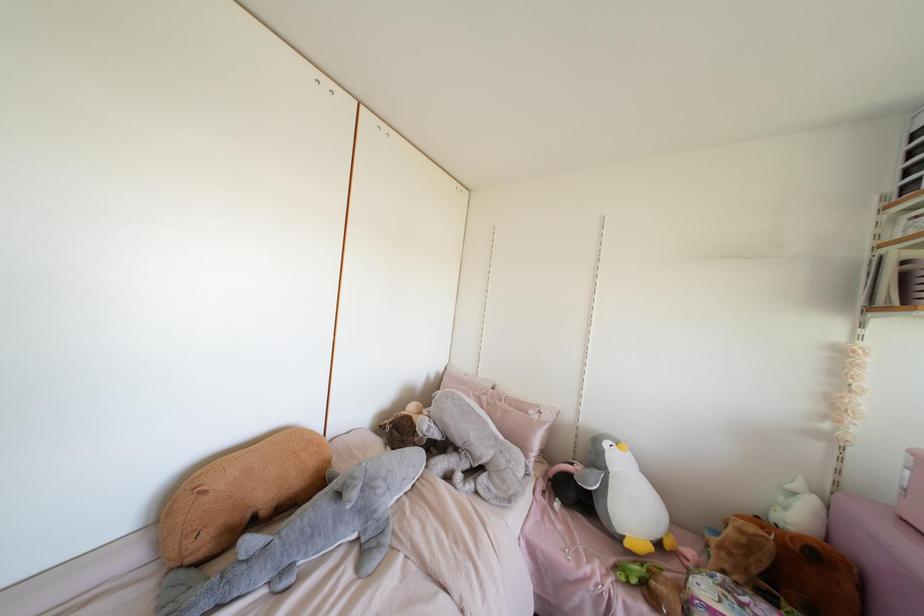
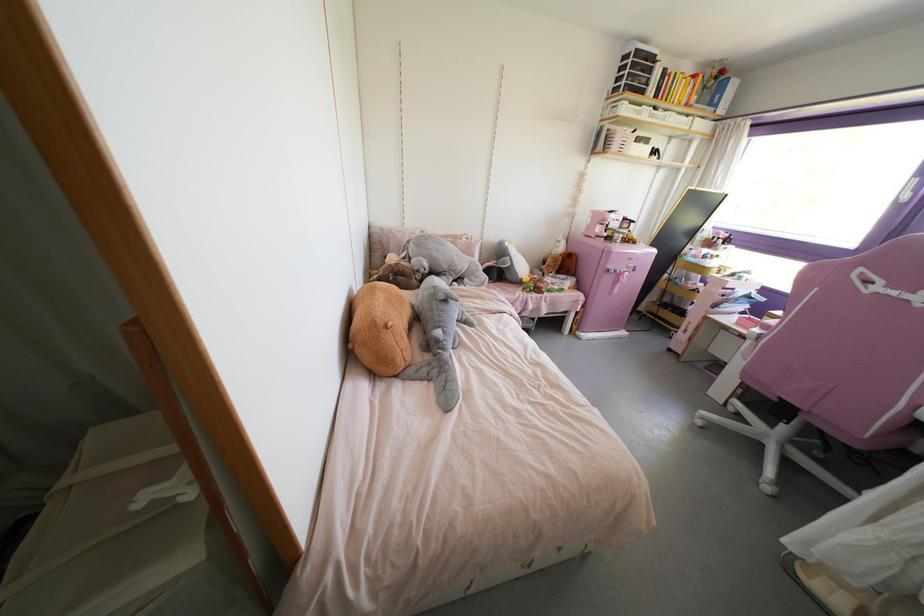
The point at [508,500] is marked in the first image. Where is the corresponding point in the second image?

(482, 284)